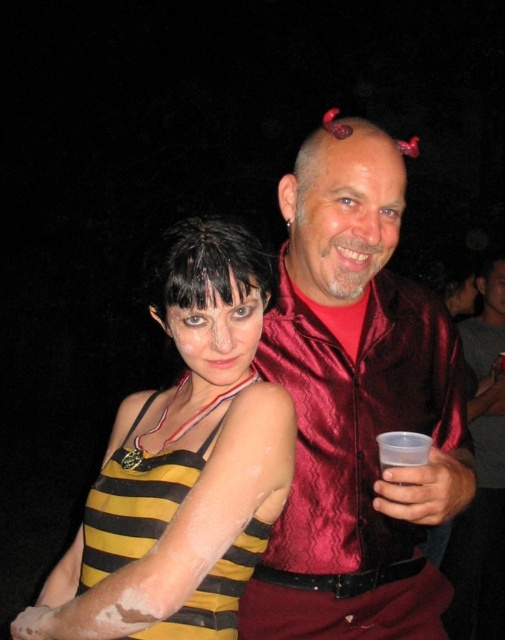
Question: Which point is closer to the camera?

Choices:
 (A) shiny red shirt at center
 (B) shiny red satin shirt at center

Answer: (B)

Question: Which of the following is the farthest from the observer?

Choices:
 (A) yellow striped tank top at center
 (B) dark shiny hair at center
 (C) shiny red shirt at center

Answer: (C)

Question: Which object is positioned farthest from the shiny red satin shirt at center?

Choices:
 (A) dark shiny hair at center
 (B) shiny red shirt at center
 (C) yellow striped tank top at center

Answer: (B)

Question: Is white matte arm at center to the left of dark shiny hair at center from the viewer's perspective?

Choices:
 (A) yes
 (B) no

Answer: (A)

Question: Does shiny red satin shirt at center come behind dark shiny hair at center?

Choices:
 (A) yes
 (B) no

Answer: (A)

Question: In this image, where is yellow striped tank top at center located relative to white matte arm at center?

Choices:
 (A) left
 (B) right

Answer: (B)